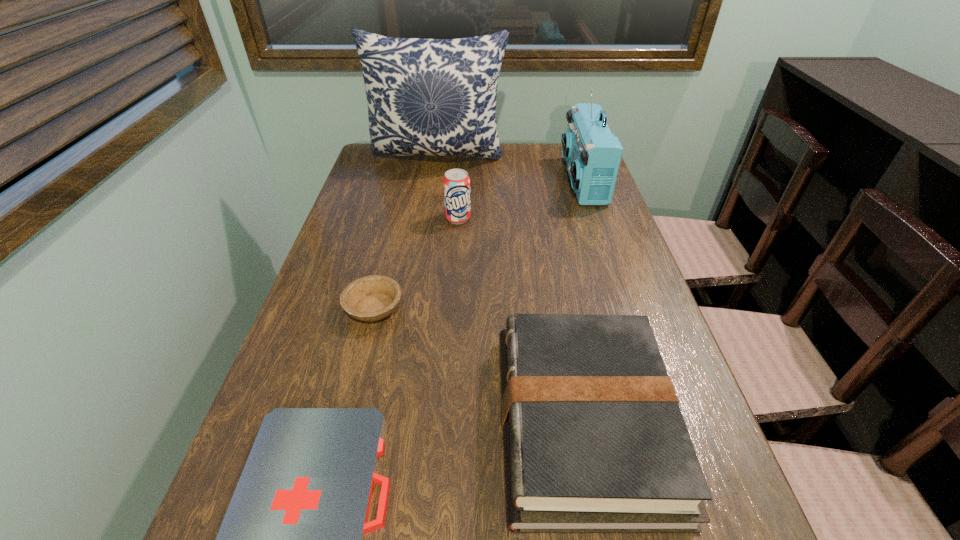
Where is `vacant position located 0.080m on the front-facing side of the radio receiver`? Image resolution: width=960 pixels, height=540 pixels. vacant position located 0.080m on the front-facing side of the radio receiver is located at coordinates pyautogui.click(x=540, y=181).

Locate an element on the screen. This screenshot has height=540, width=960. vacant space located 0.180m on the right of the third farthest object is located at coordinates (537, 218).

The image size is (960, 540). Find the location of `free spot located on the spine side of the hardback book`. free spot located on the spine side of the hardback book is located at coordinates (338, 422).

This screenshot has width=960, height=540. I want to click on blank space located on the spine side of the hardback book, so click(x=448, y=422).

What are the coordinates of `free spot located 0.130m on the spine side of the hardback book` in the screenshot? It's located at (425, 422).

Where is `vacant area situated on the right of the second shortest object`? The height and width of the screenshot is (540, 960). vacant area situated on the right of the second shortest object is located at coordinates (500, 308).

At what (x,y) coordinates should I click in order to perform the action: click on cushion present at the far edge. Please return your answer as a coordinate pair (x, y). Looking at the image, I should click on click(x=433, y=97).

This screenshot has width=960, height=540. Find the location of `radio receiver that is at the far edge`. radio receiver that is at the far edge is located at coordinates (592, 153).

Where is `cushion present at the left edge`? cushion present at the left edge is located at coordinates (433, 97).

Where is `bowl that is at the left edge`? bowl that is at the left edge is located at coordinates (369, 298).